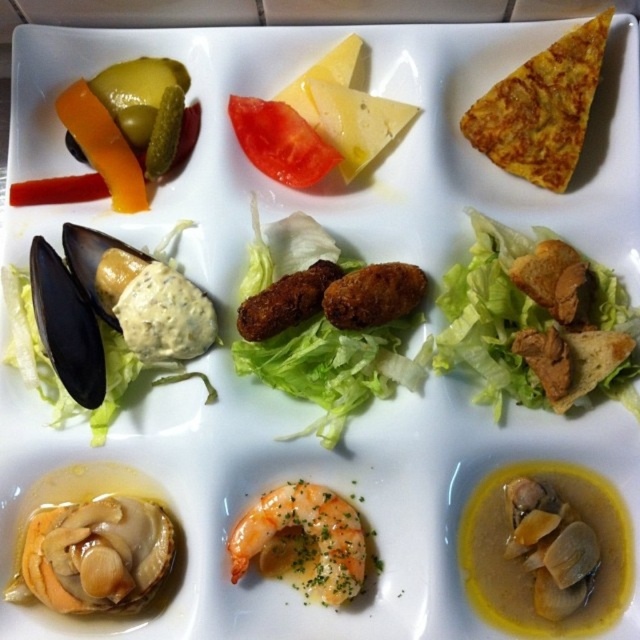
Question: Is shiny orange shellfish at bottom left positioned at the back of yellow crispy tortilla at upper right?

Choices:
 (A) no
 (B) yes

Answer: (A)

Question: Which point is farther from the camera taking this photo?

Choices:
 (A) (576, 372)
 (B) (572, 93)
 (C) (115, 544)
 (D) (348, 333)

Answer: (B)

Question: Is green leafy lettuce at center to the left of yellow crispy tortilla at upper right from the viewer's perspective?

Choices:
 (A) no
 (B) yes

Answer: (B)

Question: Among these objects, which one is nearest to the camera?

Choices:
 (A) yellow crispy tortilla at upper right
 (B) green leafy lettuce at center

Answer: (B)

Question: Does green leafy lettuce at center have a larger size compared to yellow crispy tortilla at upper right?

Choices:
 (A) yes
 (B) no

Answer: (A)

Question: Which object is positioned farthest from the green leafy lettuce at center?

Choices:
 (A) golden crispy croquettes at center
 (B) yellow crispy tortilla at upper right

Answer: (B)